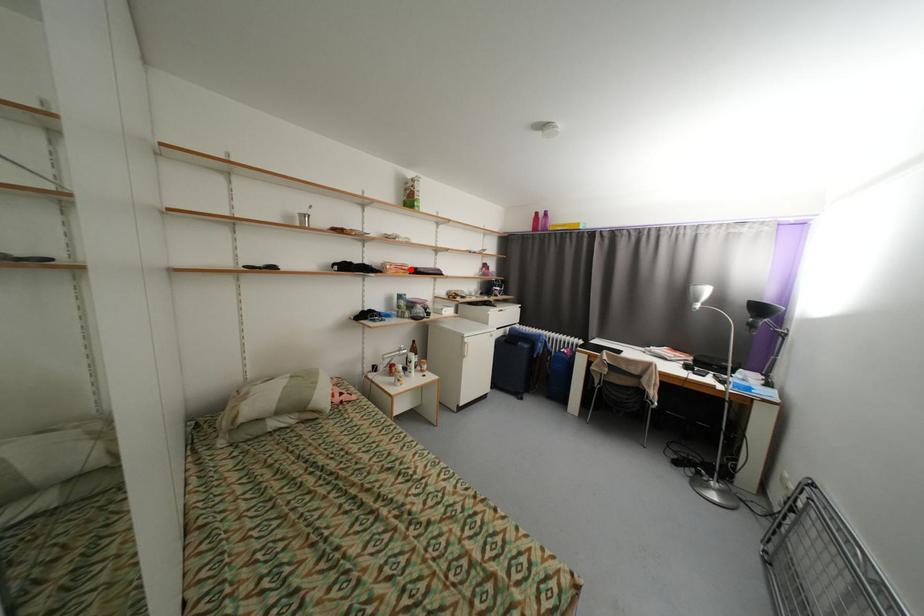
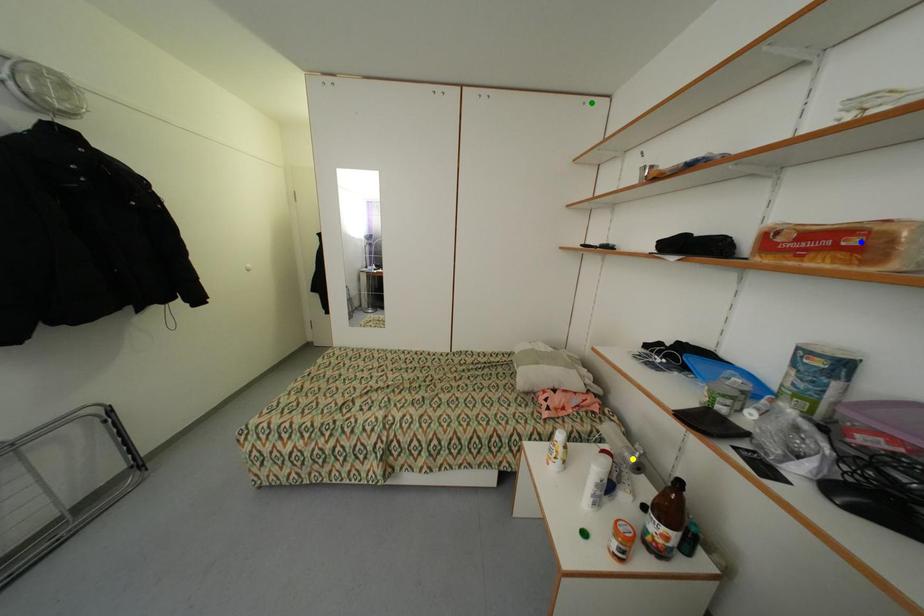
Question: I am providing you with two images of the same scene from different viewpoints. A red point is marked on the first image. You are given multiple points on the second image. In image 2, which mark is for the same physical point as the one in image 1?

Choices:
 (A) yellow point
 (B) blue point
 (C) green point

Answer: (B)